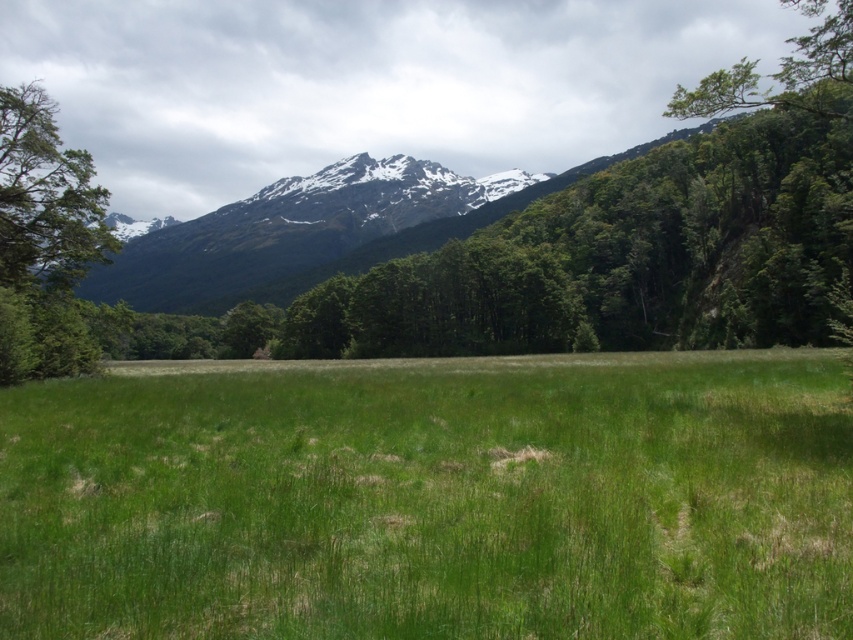
Question: Is green grassy pasture at center positioned before green leafy tree at left?

Choices:
 (A) yes
 (B) no

Answer: (A)

Question: Which point is closer to the camera?

Choices:
 (A) (788, 394)
 (B) (33, 284)
 (C) (154, 259)

Answer: (A)

Question: Can you confirm if snowy rocky mountain at upper center is smaller than green leafy tree at left?

Choices:
 (A) yes
 (B) no

Answer: (A)

Question: Among these points, which one is nearest to the camera?

Choices:
 (A) (76, 237)
 (B) (305, 209)

Answer: (A)

Question: Estimate the real-world distances between objects in this image. Which object is closer to the green leafy tree at left?

Choices:
 (A) snowy rocky mountain at upper center
 (B) green grassy pasture at center

Answer: (B)

Question: Is snowy rocky mountain at upper center above green leafy tree at left?

Choices:
 (A) yes
 (B) no

Answer: (B)